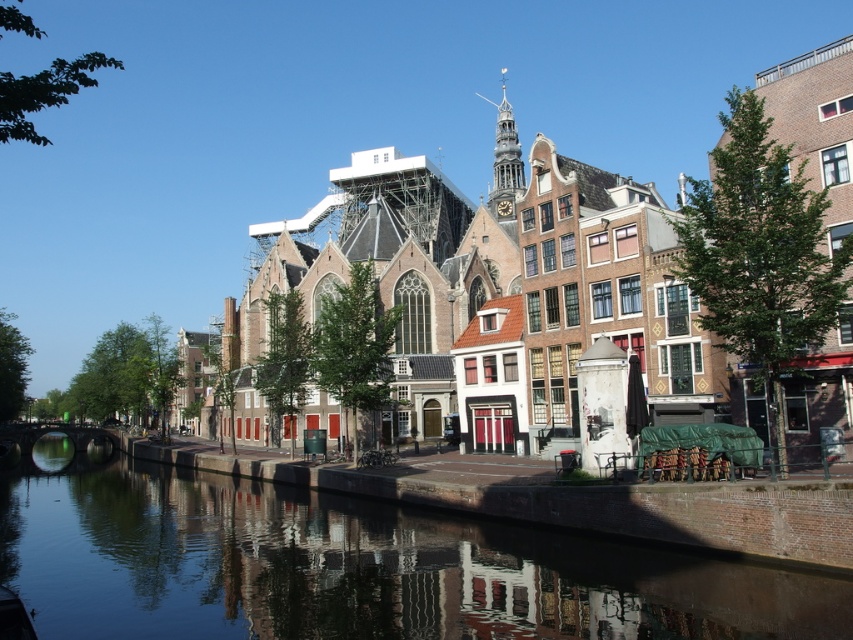
Question: Is brown brick church at center below smooth water at center?

Choices:
 (A) no
 (B) yes

Answer: (A)

Question: Does brown brick church at center have a lesser width compared to smooth water at center?

Choices:
 (A) yes
 (B) no

Answer: (A)

Question: Which point appears farthest from the camera in this image?

Choices:
 (A) (666, 216)
 (B) (554, 545)

Answer: (A)

Question: Is brown brick church at center bigger than smooth water at center?

Choices:
 (A) yes
 (B) no

Answer: (A)